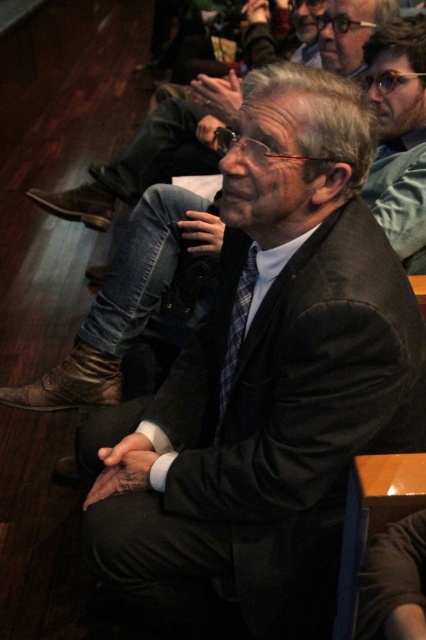
Is black wool suit at center smaller than matte black suit at upper center?

Actually, black wool suit at center might be larger than matte black suit at upper center.

Does point (152, 248) come farther from viewer compared to point (330, 19)?

No, (152, 248) is in front of (330, 19).

The image size is (426, 640). In order to click on black wool suit at center in this screenshot , I will do `click(126, 300)`.

Who is taller, matte black suit at upper center or plaid fabric tie at center?

With more height is plaid fabric tie at center.

Between point (334, 70) and point (227, 376), which one is positioned behind?

The point (334, 70) is more distant.

Locate an element on the screen. This screenshot has height=640, width=426. matte black suit at upper center is located at coordinates (350, 32).

Where is `matte black suit at upper center`? The width and height of the screenshot is (426, 640). matte black suit at upper center is located at coordinates (350, 32).

Can you confirm if black woolen suit at center is positioned to the left of black wool suit at center?

No, black woolen suit at center is not to the left of black wool suit at center.

Between black woolen suit at center and black wool suit at center, which one has more height?

With more height is black woolen suit at center.

Image resolution: width=426 pixels, height=640 pixels. I want to click on black woolen suit at center, so click(262, 435).